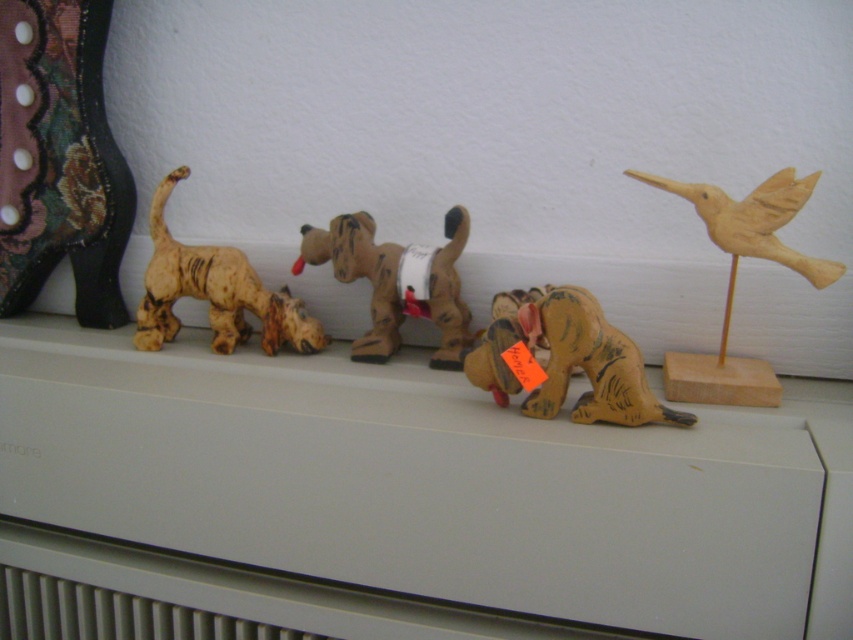
Question: Estimate the real-world distances between objects in this image. Which object is farther from the wooden bird at right?

Choices:
 (A) wooden dog at left
 (B) matte brown shelf at upper center

Answer: (A)

Question: From the image, what is the correct spatial relationship of matte brown shelf at upper center in relation to matte brown dog at center?

Choices:
 (A) left
 (B) right

Answer: (A)

Question: Is wooden bird at right above white plastic radiator at lower center?

Choices:
 (A) yes
 (B) no

Answer: (A)

Question: Is matte brown shelf at upper center smaller than wooden painted dog at center?

Choices:
 (A) no
 (B) yes

Answer: (A)

Question: Among these objects, which one is farthest from the camera?

Choices:
 (A) wooden dog at left
 (B) white plastic radiator at lower center
 (C) matte brown shelf at upper center
 (D) wooden painted dog at center

Answer: (A)

Question: Among these points, which one is farthest from the camera?

Choices:
 (A) (183, 612)
 (B) (291, 426)
 (C) (758, 388)

Answer: (A)